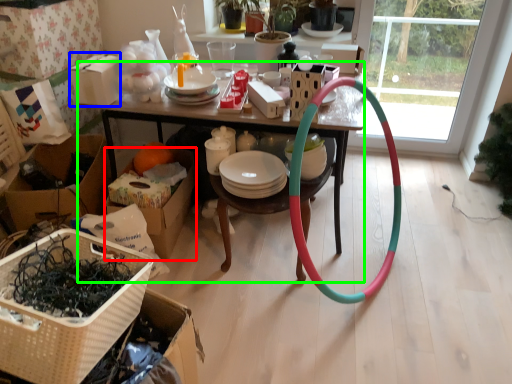
Question: Which object is positioned closest to cardboard box (highlighted by a red box)? Select from cardboard box (highlighted by a blue box) and desk (highlighted by a green box).

Choices:
 (A) cardboard box
 (B) desk

Answer: (B)